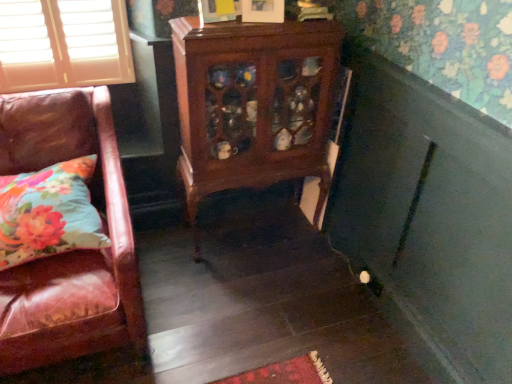
Image resolution: width=512 pixels, height=384 pixels. Identify the location of free space above floral fabric pillow at lower left (from a real-world perspective). (44, 194).